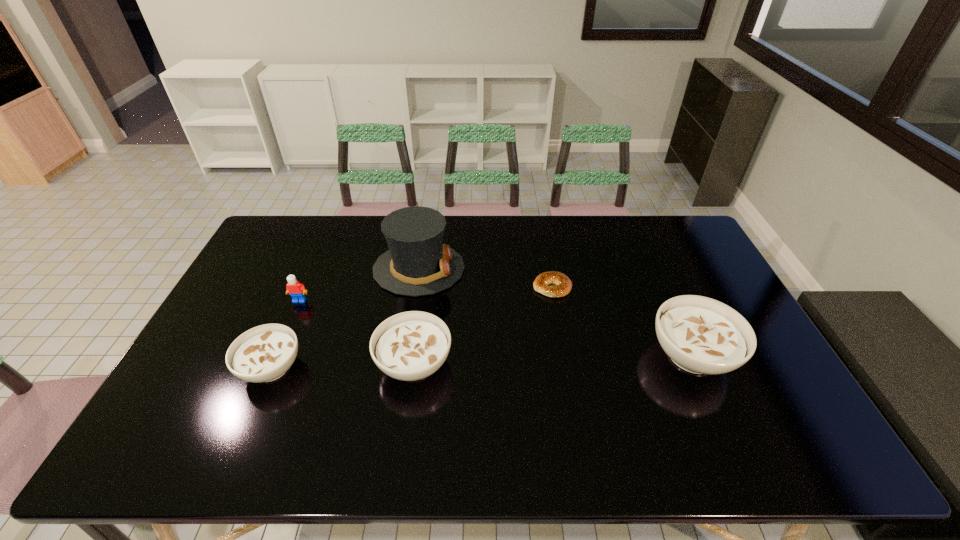
Image resolution: width=960 pixels, height=540 pixels. I want to click on the shortest soup bowl, so click(x=264, y=353).

Locate an element on the screen. The height and width of the screenshot is (540, 960). the second shortest object is located at coordinates (264, 353).

I want to click on the second tallest soup bowl, so click(x=409, y=346).

Locate an element on the screen. the rightmost object is located at coordinates (701, 335).

Where is `the fifth object from left to right`? The height and width of the screenshot is (540, 960). the fifth object from left to right is located at coordinates (562, 285).

I want to click on the shortest object, so 562,285.

You are a GUI agent. You are given a task and a screenshot of the screen. Output one action in this format:
    pyautogui.click(x=<x>, y=<y>)
    Task: Click on the tallest object
    This screenshot has height=540, width=960.
    Given the screenshot: What is the action you would take?
    pyautogui.click(x=417, y=263)

Where is `Lego`? Lego is located at coordinates point(297,290).

Find the location of a particular element. The height and width of the screenshot is (540, 960). vacant space located 0.070m on the right of the leftmost soup bowl is located at coordinates (329, 368).

Where is `vacant space located 0.200m on the back of the second soup bowl from right to left`? vacant space located 0.200m on the back of the second soup bowl from right to left is located at coordinates (424, 287).